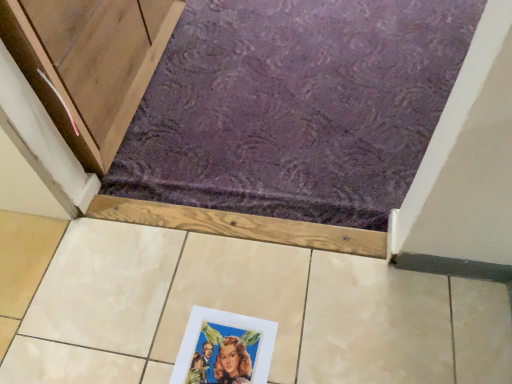
This screenshot has width=512, height=384. Find the location of `vacant area on the back side of matte paper picture frame at lower center`. vacant area on the back side of matte paper picture frame at lower center is located at coordinates (213, 279).